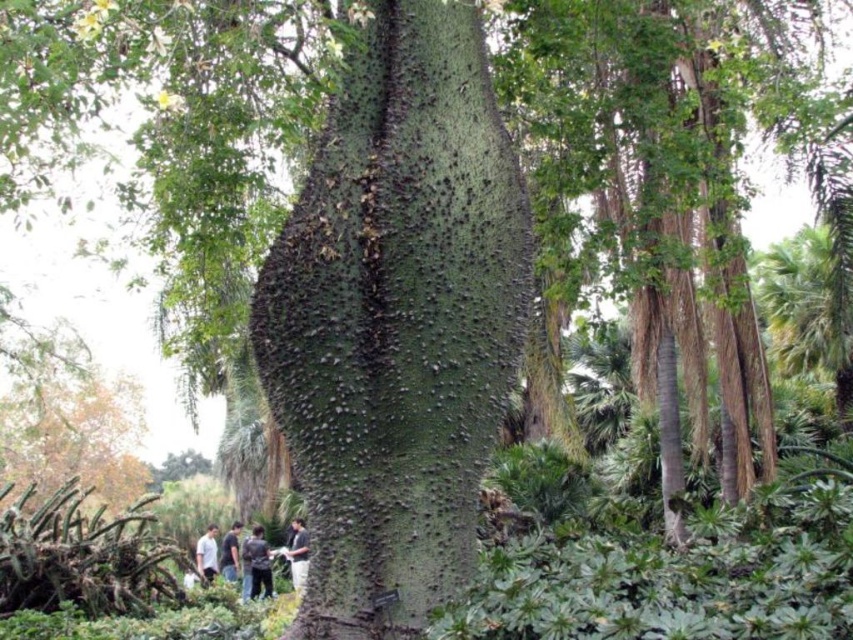
Question: Which point is farther to the camera?

Choices:
 (A) (438, 330)
 (B) (302, 547)

Answer: (B)

Question: Based on their relative distances, which object is farther from the white cotton shirt at lower left?

Choices:
 (A) dark gray shirt at lower left
 (B) dark gray textured shirt at lower center

Answer: (B)

Question: Considering the relative positions of dark gray shirt at lower center and dark gray textured shirt at lower center in the image provided, where is dark gray shirt at lower center located with respect to dark gray textured shirt at lower center?

Choices:
 (A) right
 (B) left

Answer: (B)

Question: Among these points, which one is nearest to the camera?

Choices:
 (A) (215, 541)
 (B) (288, 557)

Answer: (B)

Question: Is dark gray shirt at lower center above white cotton shirt at lower left?

Choices:
 (A) yes
 (B) no

Answer: (B)

Question: Can you confirm if dark gray shirt at lower center is positioned to the right of dark gray textured shirt at lower center?

Choices:
 (A) yes
 (B) no

Answer: (B)